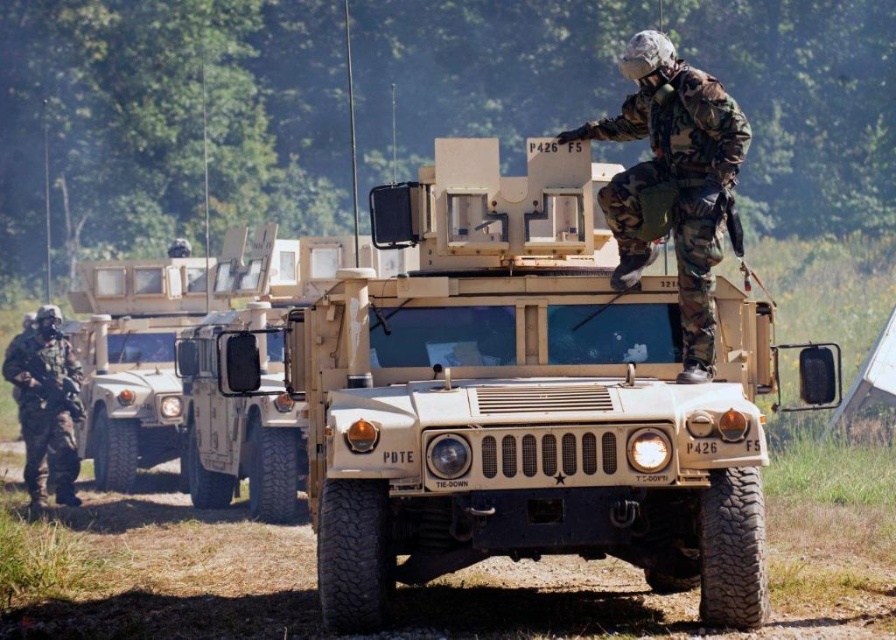
You are a photographer positioned at the camera. You want to take a photo of the camouflage fabric soldier at center. Is the distance between you and the soldier sufficient to capture a clear, detailed image with your standard camera lens?

The camouflage fabric soldier at center and camera are 8.10 meters apart from each other. With a standard camera lens, this distance should allow for a clear and detailed image as long as there are no obstructions. Adjust focus settings accordingly.

You are a drone operator observing the military training exercise. The drone is currently positioned above the tan Humvee with the mounted turret. You need to direct the drone to the camouflage fabric soldier at center. According to the coordinates provided, in which direction should the drone move to reach the soldier?

The camouflage fabric soldier at center is located at point (673,180). Since the drone is above the Humvee, which is at the front of the scene, the soldier is positioned to the lower right relative to the drone. The drone should move southeast to reach the soldier.

You are a military observer analyzing the image. There are two objects labeled as camouflage fabric soldier at center and camouflage fabric uniform at left. Which one is taller?

The camouflage fabric soldier at center is taller than the camouflage fabric uniform at left.